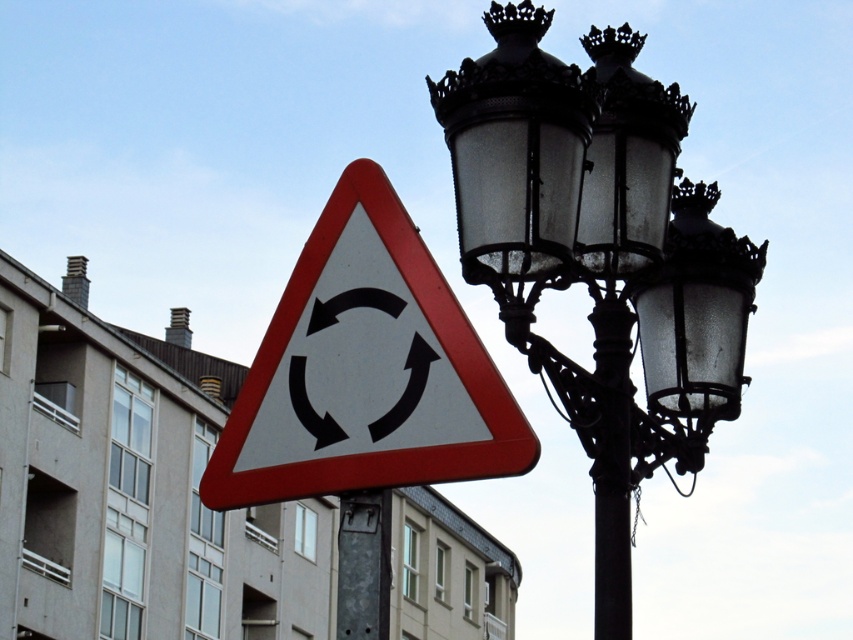
Between black wrought iron streetlight at upper right and white plastic triangle at center, which one is positioned lower?

white plastic triangle at center is below.

What do you see at coordinates (601, 256) in the screenshot? The image size is (853, 640). I see `black wrought iron streetlight at upper right` at bounding box center [601, 256].

Does point (651, 148) come behind point (341, 490)?

Yes, point (651, 148) is farther from viewer.

At what (x,y) coordinates should I click in order to perform the action: click on black wrought iron streetlight at upper right. Please return your answer as a coordinate pair (x, y). The image size is (853, 640). Looking at the image, I should click on (601, 256).

In the scene shown: Which is more to the left, black wrought iron streetlight at upper right or metallic gray pole at center?

From the viewer's perspective, metallic gray pole at center appears more on the left side.

Between black wrought iron streetlight at upper right and metallic gray pole at center, which one is positioned higher?

black wrought iron streetlight at upper right

Does point (506, 323) come farther from viewer compared to point (345, 499)?

Yes, it is.

Identify the location of black wrought iron streetlight at upper right. (601, 256).

Who is positioned more to the left, white plastic triangle at center or metallic gray pole at center?

white plastic triangle at center is more to the left.

Where is `white plastic triangle at center`? This screenshot has width=853, height=640. white plastic triangle at center is located at coordinates (364, 371).

Does point (293, 436) come in front of point (367, 604)?

No, it is behind (367, 604).

Locate an element on the screen. white plastic triangle at center is located at coordinates (364, 371).